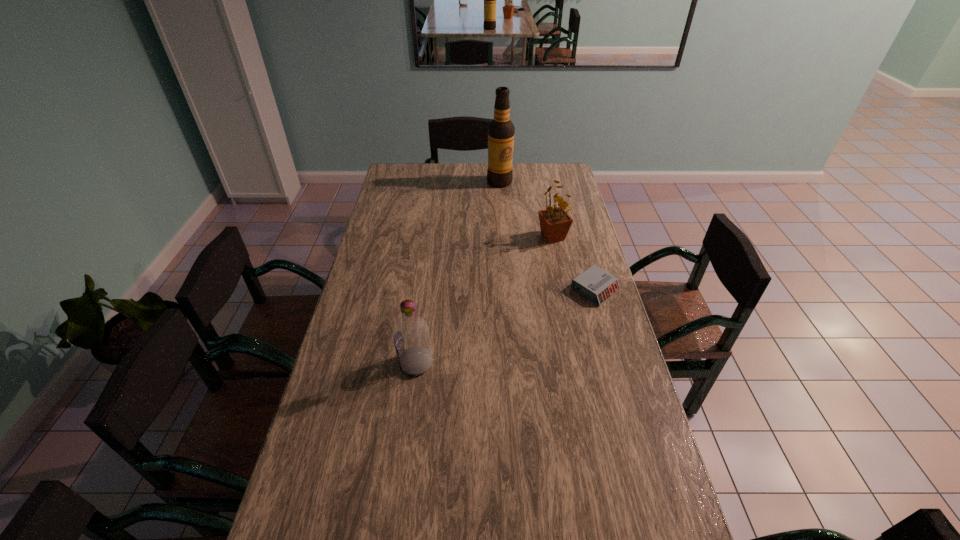
Identify the location of free space on the desktop that is between the vodka and the second nearest object and is positioned on the label of the third object from right to left. The width and height of the screenshot is (960, 540). (524, 319).

In order to click on vacant space on the desktop that is between the vodka and the alarm clock and is positioned at the front of the third nearest object with flowers visible in this screenshot , I will do `click(498, 329)`.